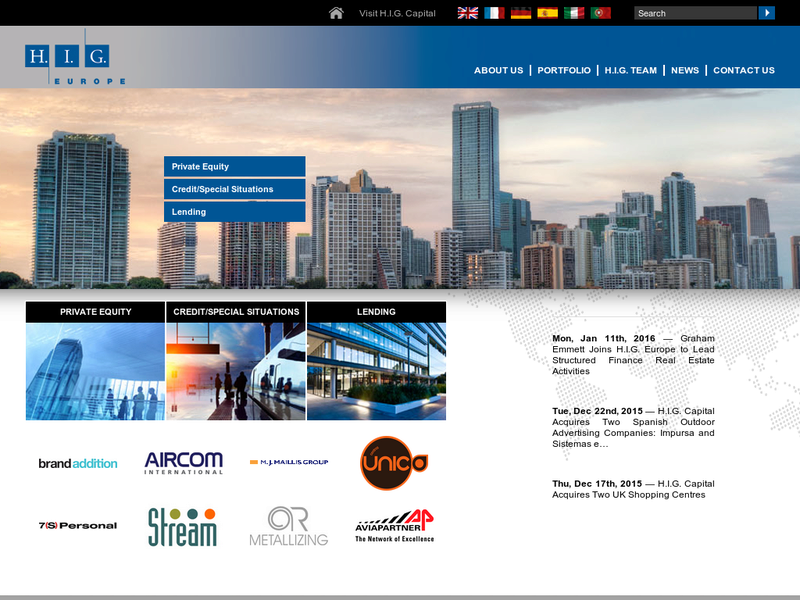
Image resolution: width=800 pixels, height=600 pixels. In order to click on windows in this screenshot , I will do `click(354, 196)`, `click(349, 224)`.